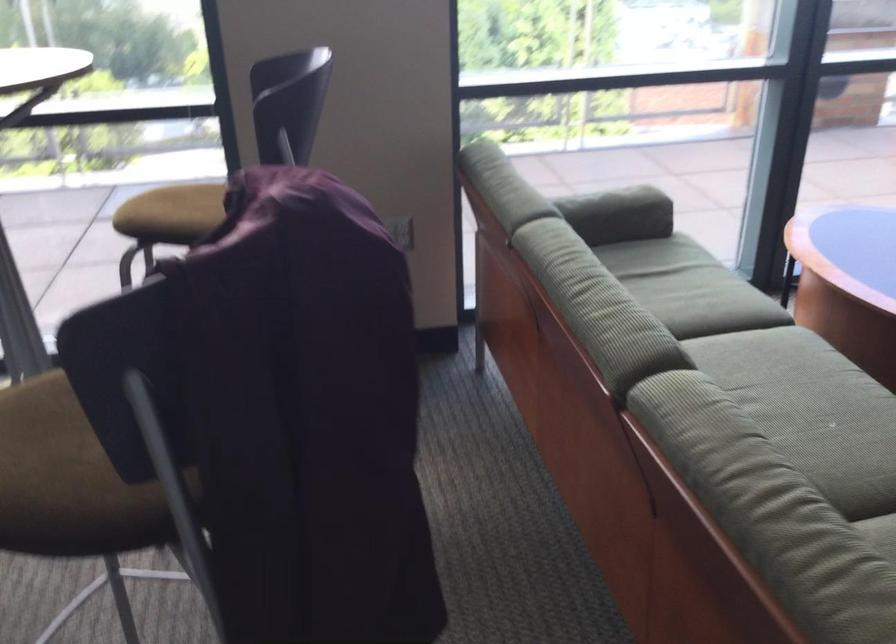
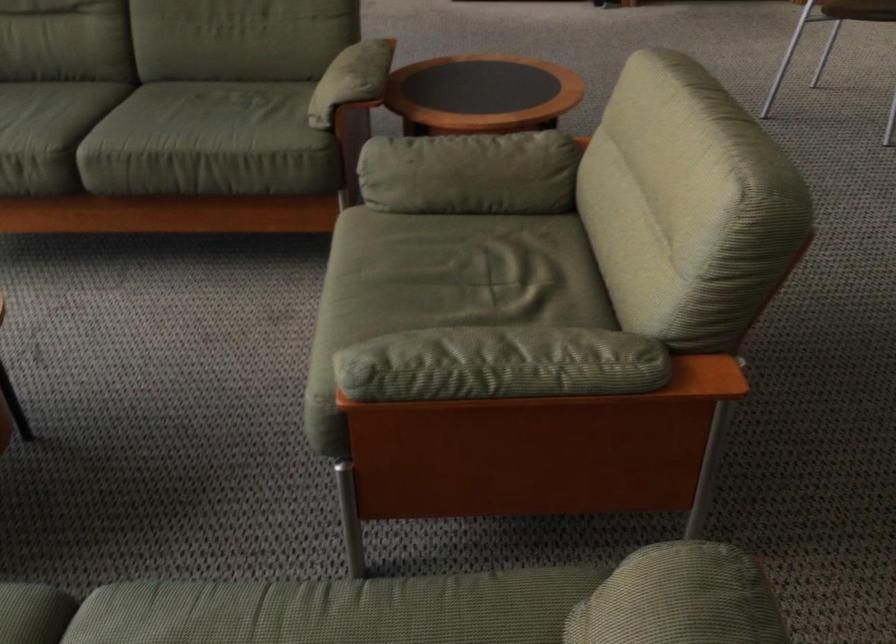
Based on the continuous images, in which direction is the camera rotating?

The camera's rotation is toward right-down.